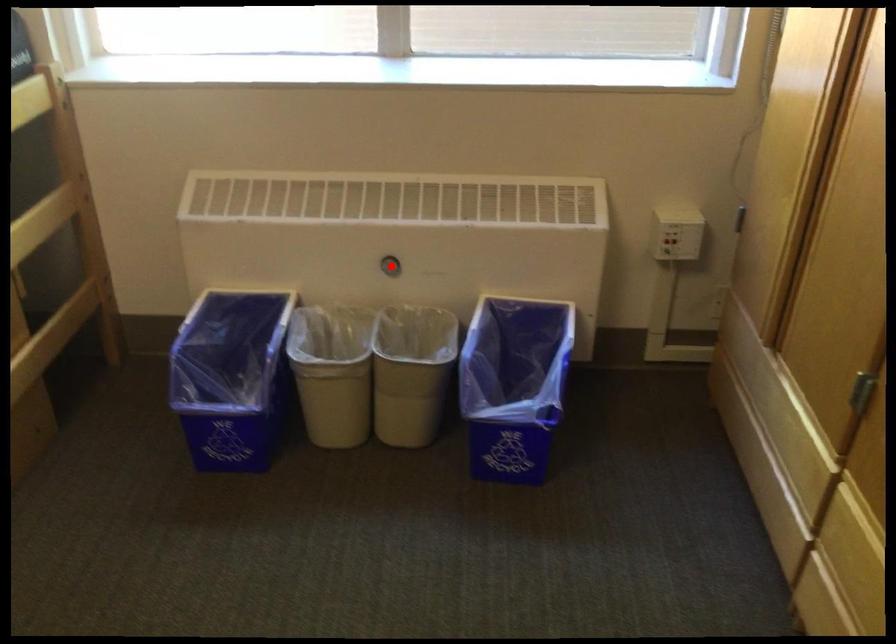
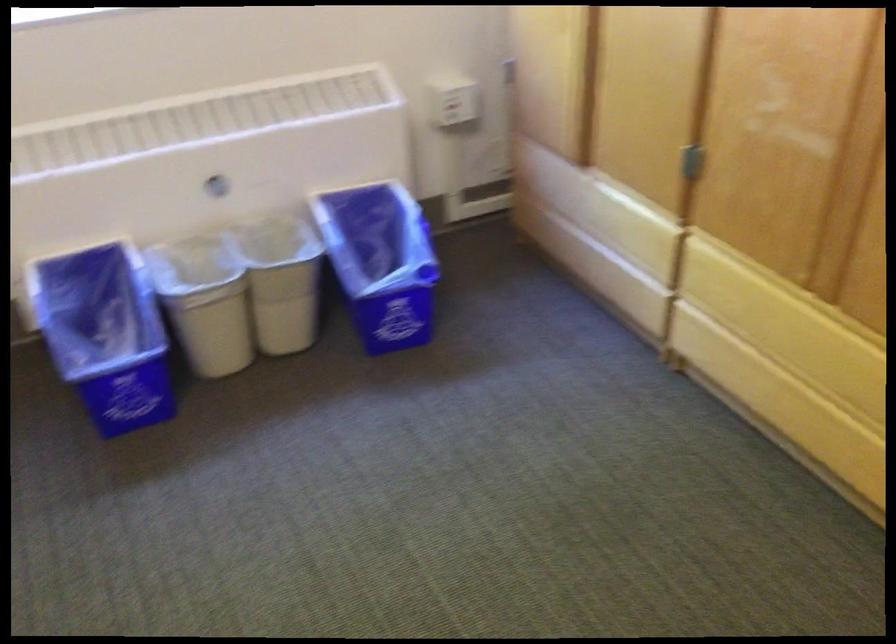
Locate, in the second image, the point that corresponds to the highlighted location in the first image.

(218, 187)